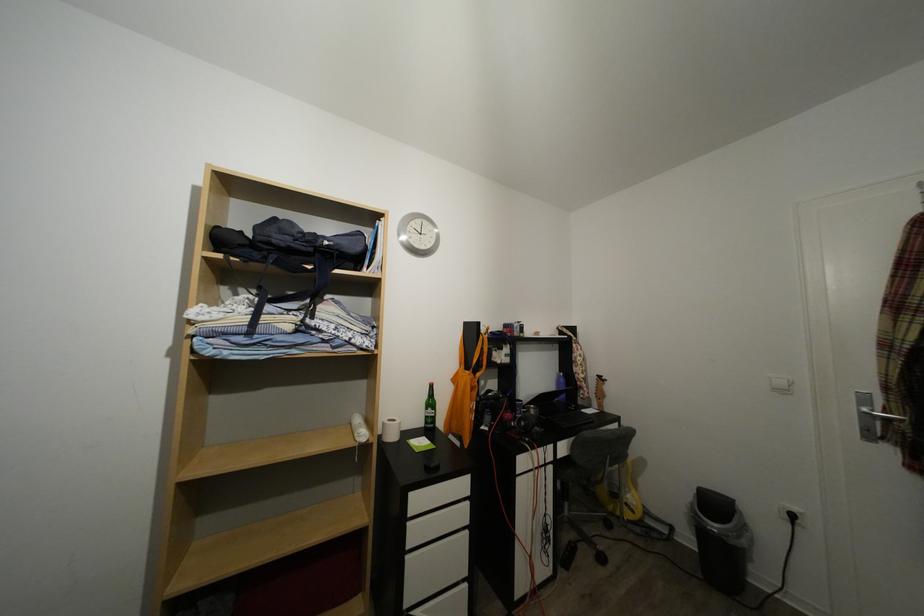
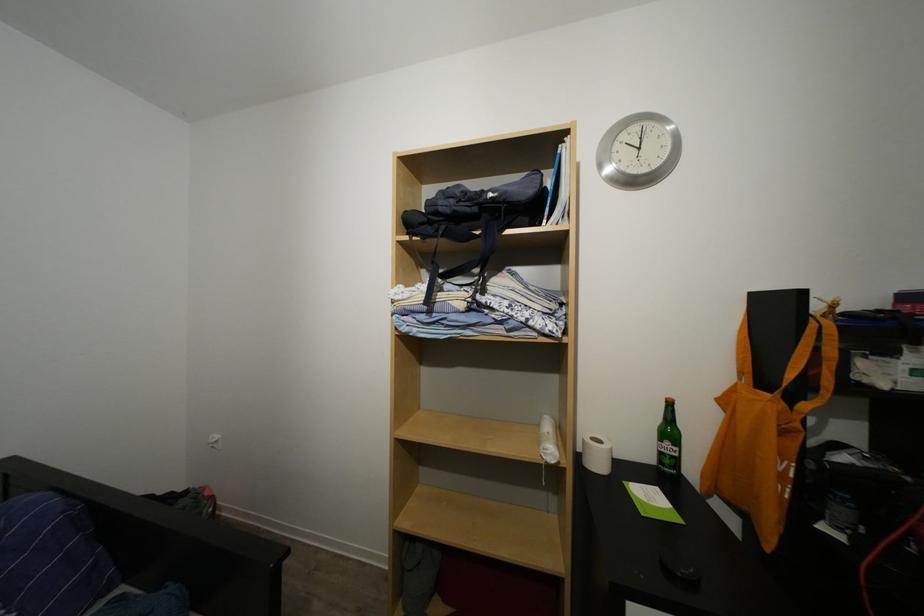
The point at (508,355) is marked in the first image. Where is the corresponding point in the second image?

(900, 360)